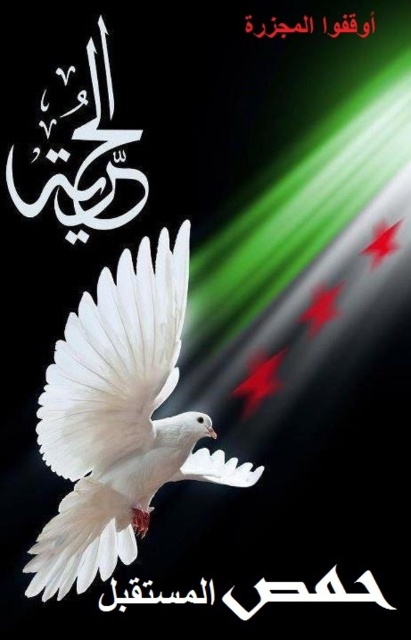
Question: From the image, what is the correct spatial relationship of matte white dove at center in relation to black calligraphy at center?

Choices:
 (A) right
 (B) left

Answer: (B)

Question: Is matte white dove at center positioned in front of black calligraphy at center?

Choices:
 (A) yes
 (B) no

Answer: (A)

Question: Does matte white dove at center appear on the right side of black calligraphy at center?

Choices:
 (A) yes
 (B) no

Answer: (B)

Question: Which object appears closest to the camera in this image?

Choices:
 (A) matte white dove at center
 (B) black calligraphy at center

Answer: (A)

Question: Which point is closer to the camera taking this photo?

Choices:
 (A) (41, 534)
 (B) (256, 582)

Answer: (A)